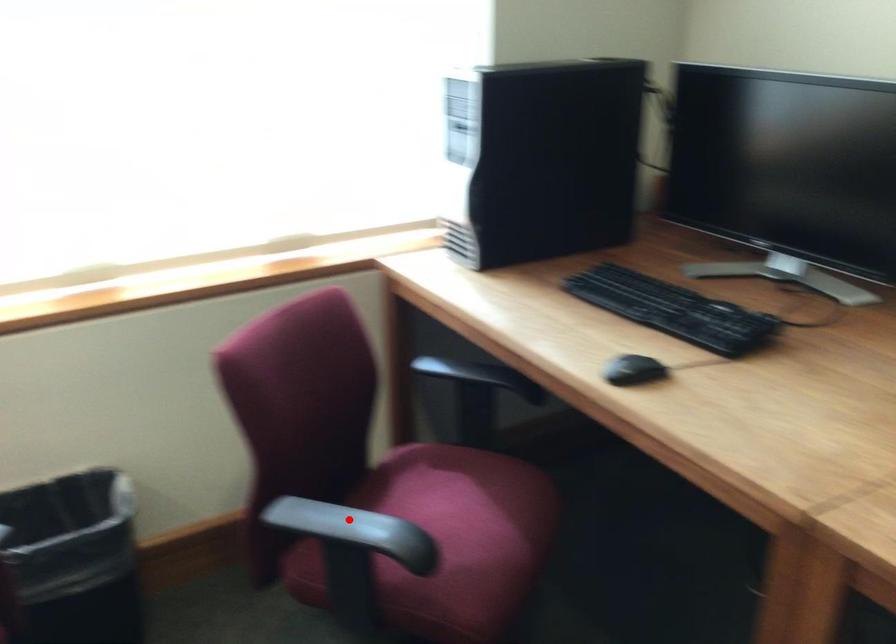
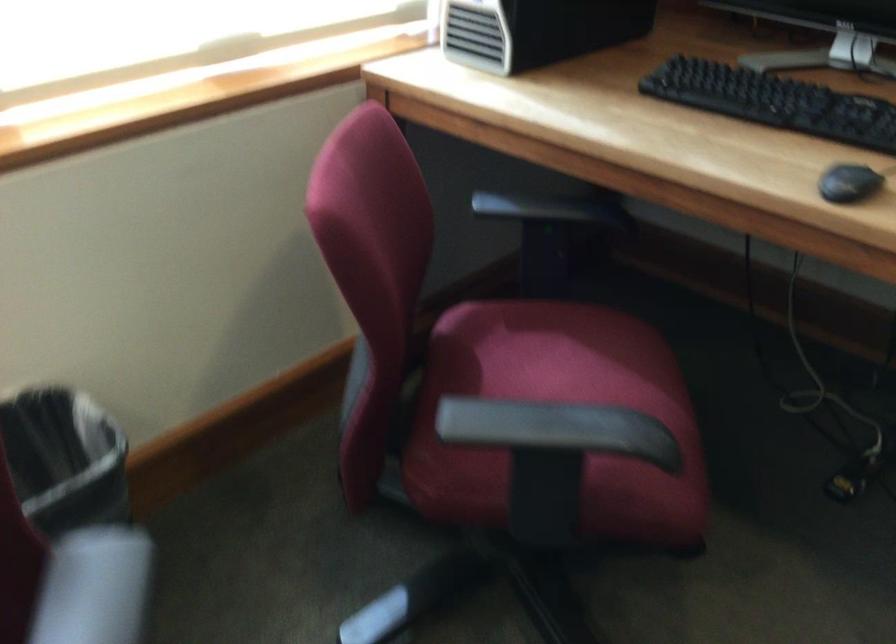
Question: I am providing you with two images of the same scene from different viewpoints. Image1 has a red point marked. In image2, the corresponding 3D location appears at what relative position? Reply with the corresponding letter.

Choices:
 (A) Closer
 (B) Farther

Answer: (A)